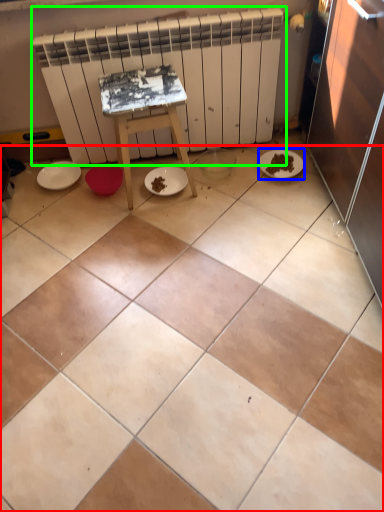
Question: Considering the real-world distances, which object is farthest from ceramic tile (highlighted by a red box)? paper plate (highlighted by a blue box) or radiator (highlighted by a green box)?

Choices:
 (A) paper plate
 (B) radiator

Answer: (A)